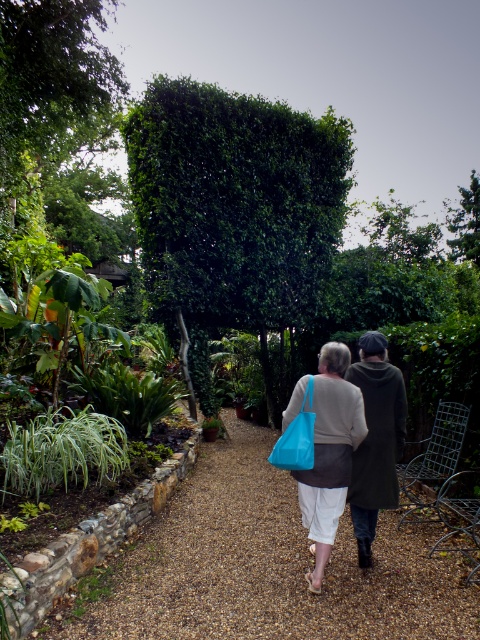
You are a photographer positioned on the gravel path in the garden scene. You want to take a photo of the blue fabric bag at center while ensuring the green leafy hedge at center is partially visible in the background. Is this possible given their positions?

The blue fabric bag at center is behind the green leafy hedge at center, so it would block the view of the bag. Therefore, you cannot capture both the blue fabric bag at center and have the green leafy hedge at center partially visible in the background simultaneously.

You are a gardener planning to plant flowers along the brown gravel path at center and the green leafy hedge at center. Which area has more space available for planting?

The green leafy hedge at center has more space available for planting since it occupies more space than the brown gravel path at center.

You are a gardener who wants to place a decorative statue on the brown gravel path at center. To ensure it doesn not block the view of the green leafy hedge at center, where should you place the statue?

The brown gravel path at center is located below the green leafy hedge at center. To avoid blocking the view of the hedge, place the statue on the lower part of the path so it remains visible beneath the hedge.